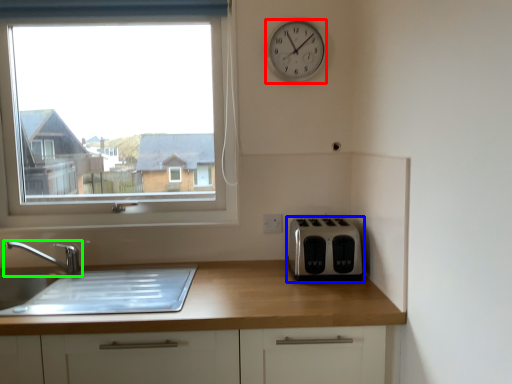
Question: Which is nearer to the clock (highlighted by a red box)? toaster (highlighted by a blue box) or tap (highlighted by a green box).

Choices:
 (A) toaster
 (B) tap

Answer: (A)